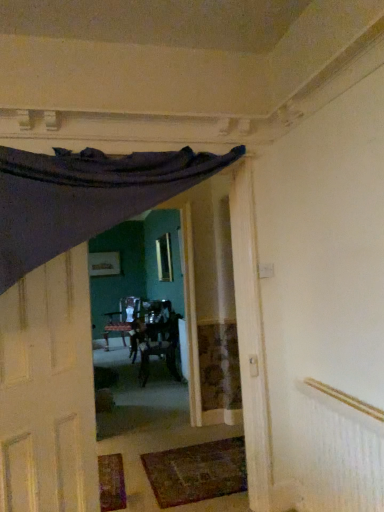
Where is `vacant space situated above dark brown woven mat at lower center (from a real-world perspective)`? The height and width of the screenshot is (512, 384). vacant space situated above dark brown woven mat at lower center (from a real-world perspective) is located at coordinates (204, 459).